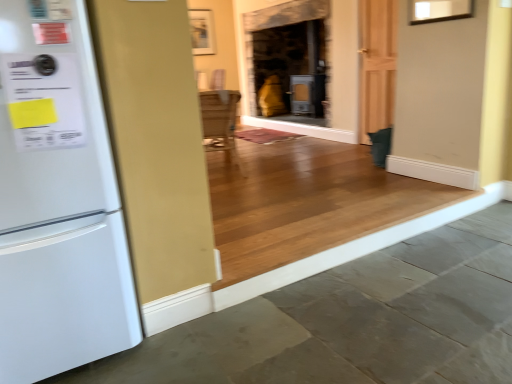
Question: From the image's perspective, does white matte refrigerator at left appear higher than gray concrete at lower left?

Choices:
 (A) yes
 (B) no

Answer: (A)

Question: Is white matte refrigerator at left bigger than gray concrete at lower left?

Choices:
 (A) no
 (B) yes

Answer: (B)

Question: Is white matte refrigerator at left behind gray concrete at lower left?

Choices:
 (A) yes
 (B) no

Answer: (A)

Question: Is white matte refrigerator at left positioned with its back to gray concrete at lower left?

Choices:
 (A) no
 (B) yes

Answer: (A)

Question: Does white matte refrigerator at left have a greater width compared to gray concrete at lower left?

Choices:
 (A) yes
 (B) no

Answer: (B)

Question: Considering the positions of point (11, 306) and point (196, 43), is point (11, 306) closer or farther from the camera than point (196, 43)?

Choices:
 (A) farther
 (B) closer

Answer: (B)

Question: Looking at their shapes, would you say white matte refrigerator at left is wider or thinner than wooden frame at upper center?

Choices:
 (A) thin
 (B) wide

Answer: (B)

Question: From the image's perspective, is white matte refrigerator at left located above or below wooden frame at upper center?

Choices:
 (A) above
 (B) below

Answer: (B)

Question: Is white matte refrigerator at left taller or shorter than wooden frame at upper center?

Choices:
 (A) short
 (B) tall

Answer: (B)

Question: Is white matte refrigerator at left inside the boundaries of gray concrete at lower left, or outside?

Choices:
 (A) inside
 (B) outside

Answer: (B)

Question: Is white matte refrigerator at left to the left or to the right of gray concrete at lower left in the image?

Choices:
 (A) right
 (B) left

Answer: (B)

Question: Is white matte refrigerator at left in front of or behind gray concrete at lower left in the image?

Choices:
 (A) behind
 (B) front

Answer: (A)

Question: From a real-world perspective, is white matte refrigerator at left positioned above or below gray concrete at lower left?

Choices:
 (A) below
 (B) above

Answer: (B)

Question: In terms of size, does gray concrete at lower left appear bigger or smaller than wooden frame at upper center?

Choices:
 (A) big
 (B) small

Answer: (A)

Question: Is gray concrete at lower left in front of or behind wooden frame at upper center in the image?

Choices:
 (A) front
 (B) behind

Answer: (A)